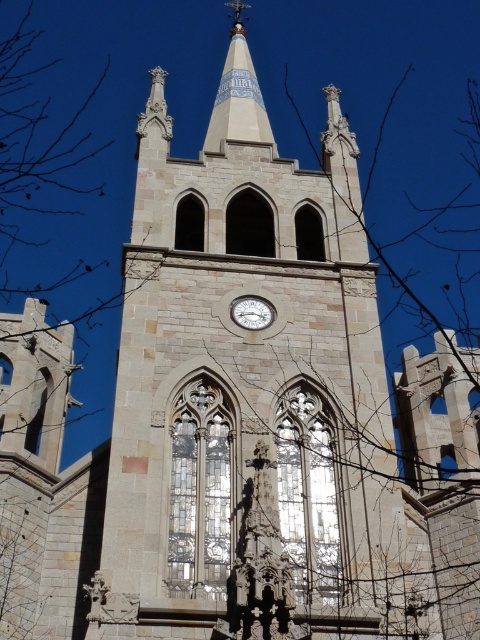
Does white stone spire at upper center have a smaller size compared to metallic silver clock at center?

No.

This screenshot has height=640, width=480. I want to click on white stone spire at upper center, so click(238, 93).